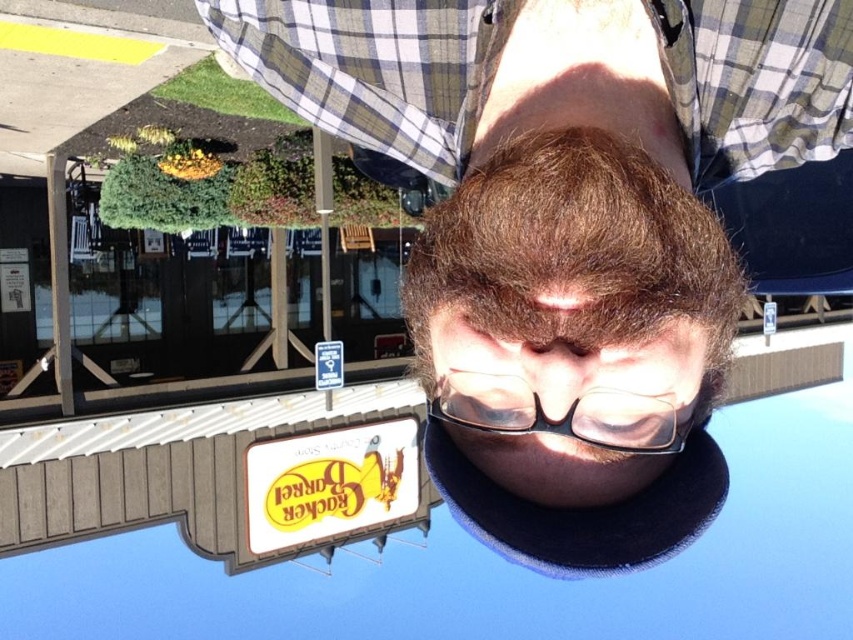
Does brown matte hair at center lie in front of white matte sign at lower center?

Yes, it is in front of white matte sign at lower center.

Is brown matte hair at center below white matte sign at lower center?

Incorrect, brown matte hair at center is not positioned below white matte sign at lower center.

Does point (436, 403) lie behind point (416, 460)?

No, (436, 403) is closer to viewer.

This screenshot has width=853, height=640. In order to click on brown matte hair at center in this screenshot , I will do `click(573, 308)`.

Can you confirm if white matte sign at lower center is positioned to the right of transparent plastic glasses at center?

Incorrect, white matte sign at lower center is not on the right side of transparent plastic glasses at center.

Does point (410, 506) come in front of point (595, 424)?

No, it is not.

Is point (357, 448) positioned behind point (444, 378)?

Yes, it is behind point (444, 378).

Identify the location of white matte sign at lower center. pyautogui.click(x=329, y=483).

Is brown matte hair at center to the right of transparent plastic glasses at center from the viewer's perspective?

Indeed, brown matte hair at center is positioned on the right side of transparent plastic glasses at center.

Is point (512, 365) positioned behind point (566, 417)?

Yes, it is.

Locate an element on the screen. The width and height of the screenshot is (853, 640). brown matte hair at center is located at coordinates (573, 308).